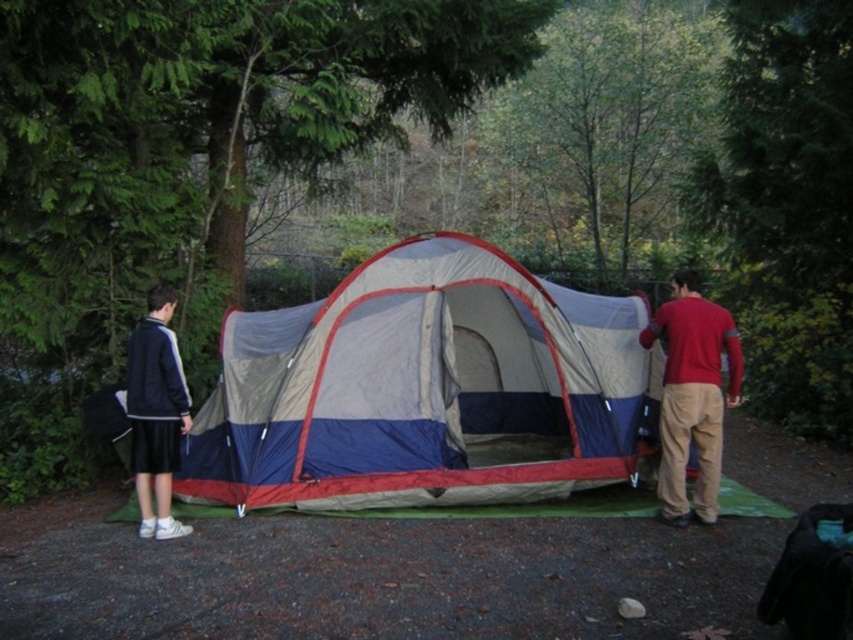
Question: Can you confirm if red cotton shirt at center is positioned to the right of dark blue jacket at left?

Choices:
 (A) yes
 (B) no

Answer: (A)

Question: From the image, what is the correct spatial relationship of red cotton shirt at center in relation to dark blue jacket at left?

Choices:
 (A) above
 (B) below

Answer: (A)

Question: Which object is the farthest from the blue tarpaulin tent at center?

Choices:
 (A) red cotton shirt at center
 (B) dark blue jacket at left

Answer: (A)

Question: Can you confirm if blue tarpaulin tent at center is bigger than dark blue jacket at left?

Choices:
 (A) yes
 (B) no

Answer: (A)

Question: Which is nearer to the red cotton shirt at center?

Choices:
 (A) blue tarpaulin tent at center
 (B) dark blue jacket at left

Answer: (A)

Question: Which of the following is the closest to the observer?

Choices:
 (A) (683, 481)
 (B) (403, 241)

Answer: (A)